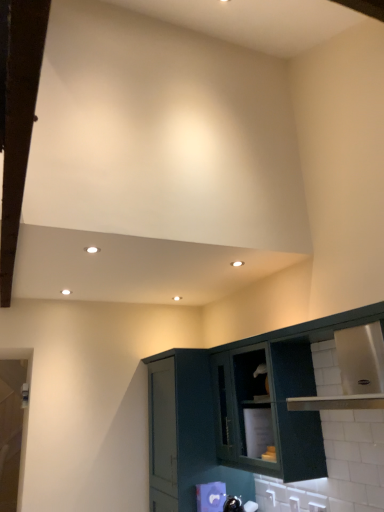
How much space does white plastic electric outlet at lower right, placed as the third electric outlet when sorted from right to left, occupy horizontally?

1.19 inches.

What is the approximate width of green matte cabinet at lower right, the 2th cabinetry in the right-to-left sequence?

A: green matte cabinet at lower right, the 2th cabinetry in the right-to-left sequence, is 25.14 inches in width.

What do you see at coordinates (268, 409) in the screenshot?
I see `matte dark green cabinet at lower right` at bounding box center [268, 409].

Where is `white plastic electric outlet at lower right, which is the third electric outlet in back-to-front order`? white plastic electric outlet at lower right, which is the third electric outlet in back-to-front order is located at coordinates (317, 507).

Image resolution: width=384 pixels, height=512 pixels. What do you see at coordinates (317, 507) in the screenshot? I see `white plastic electric outlet at lower right, the 1th electric outlet viewed from the front` at bounding box center [317, 507].

Find the location of a particular element. white plastic electric outlet at lower right, the 2th electric outlet viewed from the front is located at coordinates [x=294, y=504].

The width and height of the screenshot is (384, 512). What are the coordinates of `white plastic electric outlet at lower right, placed as the third electric outlet when sorted from front to back` in the screenshot? It's located at click(271, 496).

Which is closer to the camera, (167,399) or (271,499)?

Point (167,399) is positioned farther from the camera compared to point (271,499).

At what (x,y) coordinates should I click in order to perform the action: click on the 3rd electric outlet below when counting from the green matte cabinet at lower right, the 2th cabinetry in the right-to-left sequence (from the image's perspective). Please return your answer as a coordinate pair (x, y). Looking at the image, I should click on pyautogui.click(x=271, y=496).

Is green matte cabinet at lower right, which is the 1th cabinetry from left to right, taller or shorter than white plastic electric outlet at lower right, the 1th electric outlet when ordered from back to front?

In the image, green matte cabinet at lower right, which is the 1th cabinetry from left to right, appears to be taller than white plastic electric outlet at lower right, the 1th electric outlet when ordered from back to front.

Which of these two, green matte cabinet at lower right, the 2th cabinetry in the right-to-left sequence, or white plastic electric outlet at lower right, the 1th electric outlet when ordered from back to front, is thinner?

white plastic electric outlet at lower right, the 1th electric outlet when ordered from back to front.

From the picture: Does white plastic electric outlet at lower right, acting as the 3th electric outlet starting from the left, have a lesser width compared to matte dark green cabinet at lower right?

Indeed, white plastic electric outlet at lower right, acting as the 3th electric outlet starting from the left, has a lesser width compared to matte dark green cabinet at lower right.

Looking at this image, does white plastic electric outlet at lower right, acting as the 3th electric outlet starting from the left, lie behind matte dark green cabinet at lower right?

Yes, white plastic electric outlet at lower right, acting as the 3th electric outlet starting from the left, is behind matte dark green cabinet at lower right.

Is white plastic electric outlet at lower right, acting as the 3th electric outlet starting from the left, oriented away from stainless steel cabinet at lower right, which is the second cabinetry from left to right?

That's right, white plastic electric outlet at lower right, acting as the 3th electric outlet starting from the left, is facing away from stainless steel cabinet at lower right, which is the second cabinetry from left to right.

Is point (321, 505) closer to viewer compared to point (367, 312)?

No, it is not.

Is white plastic electric outlet at lower right, which is the third electric outlet in back-to-front order, inside the boundaries of stainless steel cabinet at lower right, marked as the 1th cabinetry in a right-to-left arrangement, or outside?

white plastic electric outlet at lower right, which is the third electric outlet in back-to-front order, can be found inside stainless steel cabinet at lower right, marked as the 1th cabinetry in a right-to-left arrangement.

From a real-world perspective, relative to white plastic electric outlet at lower right, placed as the third electric outlet when sorted from right to left, is stainless steel cabinet at lower right, which is the second cabinetry from left to right, vertically above or below?

From a real-world perspective, stainless steel cabinet at lower right, which is the second cabinetry from left to right, is physically above white plastic electric outlet at lower right, placed as the third electric outlet when sorted from right to left.

How many degrees apart are the facing directions of stainless steel cabinet at lower right, which is the second cabinetry from left to right, and white plastic electric outlet at lower right, placed as the third electric outlet when sorted from front to back?

1.23 degrees.

Is stainless steel cabinet at lower right, marked as the 1th cabinetry in a right-to-left arrangement, looking in the opposite direction of white plastic electric outlet at lower right, placed as the third electric outlet when sorted from right to left?

Yes, stainless steel cabinet at lower right, marked as the 1th cabinetry in a right-to-left arrangement, is facing away from white plastic electric outlet at lower right, placed as the third electric outlet when sorted from right to left.

From the image's perspective, is stainless steel cabinet at lower right, which is the second cabinetry from left to right, above white plastic electric outlet at lower right, placed as the third electric outlet when sorted from right to left?

Yes, from the image's perspective, stainless steel cabinet at lower right, which is the second cabinetry from left to right, is over white plastic electric outlet at lower right, placed as the third electric outlet when sorted from right to left.

Is white plastic electric outlet at lower right, the 2th electric outlet viewed from the front, shorter than green matte cabinet at lower right, the 2th cabinetry in the right-to-left sequence?

Indeed, white plastic electric outlet at lower right, the 2th electric outlet viewed from the front, has a lesser height compared to green matte cabinet at lower right, the 2th cabinetry in the right-to-left sequence.

Can you confirm if white plastic electric outlet at lower right, the 2th electric outlet viewed from the front, is bigger than green matte cabinet at lower right, which is the 1th cabinetry from left to right?

No, white plastic electric outlet at lower right, the 2th electric outlet viewed from the front, is not bigger than green matte cabinet at lower right, which is the 1th cabinetry from left to right.

Consider the image. Is white plastic electric outlet at lower right, the 2th electric outlet viewed from the right, positioned behind green matte cabinet at lower right, the 2th cabinetry in the right-to-left sequence?

No, it is not.

Identify the location of the 1st electric outlet behind the matte dark green cabinet at lower right, counting from the anchor's position. This screenshot has width=384, height=512. (317, 507).

Which is correct: matte dark green cabinet at lower right is inside white plastic electric outlet at lower right, acting as the 3th electric outlet starting from the left, or outside of it?

The correct answer is: outside.

Is matte dark green cabinet at lower right far from white plastic electric outlet at lower right, the 1th electric outlet when ordered from right to left?

matte dark green cabinet at lower right is actually quite close to white plastic electric outlet at lower right, the 1th electric outlet when ordered from right to left.

Is matte dark green cabinet at lower right thinner than green matte cabinet at lower right, the 2th cabinetry in the right-to-left sequence?

Yes, matte dark green cabinet at lower right is thinner than green matte cabinet at lower right, the 2th cabinetry in the right-to-left sequence.

From the image's perspective, which is below, matte dark green cabinet at lower right or green matte cabinet at lower right, the 2th cabinetry in the right-to-left sequence?

green matte cabinet at lower right, the 2th cabinetry in the right-to-left sequence, from the image's perspective.

The image size is (384, 512). What are the coordinates of `cabinetry on the left of white plastic electric outlet at lower right, placed as the third electric outlet when sorted from front to back` in the screenshot? It's located at (185, 433).

Starting from the matte dark green cabinet at lower right, which electric outlet is the 1st one behind? Please provide its 2D coordinates.

[(317, 507)]

Based on their spatial positions, is white plastic electric outlet at lower right, placed as the third electric outlet when sorted from front to back, or white plastic electric outlet at lower right, which is the third electric outlet in back-to-front order, closer to white plastic electric outlet at lower right, the 2th electric outlet viewed from the front?

The object closer to white plastic electric outlet at lower right, the 2th electric outlet viewed from the front, is white plastic electric outlet at lower right, which is the third electric outlet in back-to-front order.

Estimate the real-world distances between objects in this image. Which object is closer to white plastic electric outlet at lower right, the 2th electric outlet viewed from the right, white plastic electric outlet at lower right, the 1th electric outlet when ordered from back to front, or stainless steel cabinet at lower right, which is the second cabinetry from left to right?

The object closer to white plastic electric outlet at lower right, the 2th electric outlet viewed from the right, is white plastic electric outlet at lower right, the 1th electric outlet when ordered from back to front.

Estimate the real-world distances between objects in this image. Which object is further from white plastic electric outlet at lower right, acting as the 3th electric outlet starting from the left, matte dark green cabinet at lower right or white plastic electric outlet at lower right, placed as the third electric outlet when sorted from right to left?

Based on the image, matte dark green cabinet at lower right appears to be further to white plastic electric outlet at lower right, acting as the 3th electric outlet starting from the left.

From the image, which object appears to be nearer to white plastic electric outlet at lower right, acting as the 3th electric outlet starting from the left, white plastic electric outlet at lower right, the 2th electric outlet viewed from the back, or white plastic electric outlet at lower right, which ranks as the 1th electric outlet in left-to-right order?

Based on the image, white plastic electric outlet at lower right, the 2th electric outlet viewed from the back, appears to be nearer to white plastic electric outlet at lower right, acting as the 3th electric outlet starting from the left.

When comparing their distances from white plastic electric outlet at lower right, which ranks as the 1th electric outlet in left-to-right order, does green matte cabinet at lower right, which is the 1th cabinetry from left to right, or matte dark green cabinet at lower right seem closer?

Among the two, matte dark green cabinet at lower right is located nearer to white plastic electric outlet at lower right, which ranks as the 1th electric outlet in left-to-right order.

From the image, which object appears to be nearer to white plastic electric outlet at lower right, placed as the third electric outlet when sorted from right to left, green matte cabinet at lower right, the 2th cabinetry in the right-to-left sequence, or white plastic electric outlet at lower right, acting as the 3th electric outlet starting from the left?

white plastic electric outlet at lower right, acting as the 3th electric outlet starting from the left, lies closer to white plastic electric outlet at lower right, placed as the third electric outlet when sorted from right to left, than the other object.

From the image, which object appears to be farther from matte dark green cabinet at lower right, stainless steel cabinet at lower right, marked as the 1th cabinetry in a right-to-left arrangement, or white plastic electric outlet at lower right, acting as the 3th electric outlet starting from the left?

white plastic electric outlet at lower right, acting as the 3th electric outlet starting from the left, is positioned further to the anchor matte dark green cabinet at lower right.

Which object lies nearer to the anchor point stainless steel cabinet at lower right, which is the second cabinetry from left to right, green matte cabinet at lower right, the 2th cabinetry in the right-to-left sequence, or white plastic electric outlet at lower right, placed as the third electric outlet when sorted from right to left?

green matte cabinet at lower right, the 2th cabinetry in the right-to-left sequence, is positioned closer to the anchor stainless steel cabinet at lower right, which is the second cabinetry from left to right.

Locate an element on the screen. This screenshot has height=512, width=384. medicine cabinet between stainless steel cabinet at lower right, which is the second cabinetry from left to right, and white plastic electric outlet at lower right, the 2th electric outlet viewed from the back, along the z-axis is located at coordinates (268, 409).

Locate an element on the screen. medicine cabinet between green matte cabinet at lower right, the 2th cabinetry in the right-to-left sequence, and white plastic electric outlet at lower right, the 2th electric outlet viewed from the front is located at coordinates (268, 409).

Identify the location of cabinetry between stainless steel cabinet at lower right, marked as the 1th cabinetry in a right-to-left arrangement, and white plastic electric outlet at lower right, which ranks as the 1th electric outlet in left-to-right order, along the z-axis. This screenshot has width=384, height=512. (185, 433).

Find the location of `electric outlet between stainless steel cabinet at lower right, which is the second cabinetry from left to right, and white plastic electric outlet at lower right, the 2th electric outlet viewed from the front, in the front-back direction`. electric outlet between stainless steel cabinet at lower right, which is the second cabinetry from left to right, and white plastic electric outlet at lower right, the 2th electric outlet viewed from the front, in the front-back direction is located at coordinates (317, 507).